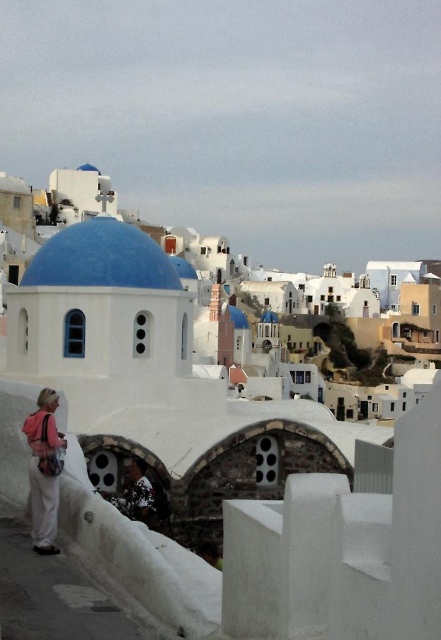
Does blue glossy dome at center have a greater width compared to camouflage shirt at center?

Indeed, blue glossy dome at center has a greater width compared to camouflage shirt at center.

Is blue glossy dome at center closer to the viewer compared to camouflage shirt at center?

No, blue glossy dome at center is further to the viewer.

Image resolution: width=441 pixels, height=640 pixels. What do you see at coordinates (100, 259) in the screenshot?
I see `blue glossy dome at center` at bounding box center [100, 259].

Identify the location of blue glossy dome at center. The width and height of the screenshot is (441, 640). 100,259.

Can you confirm if blue glossy dome at center is positioned below pink fabric at lower left?

No.

Image resolution: width=441 pixels, height=640 pixels. What are the coordinates of `blue glossy dome at center` in the screenshot? It's located at (100, 259).

Which of these two, pink fabric at lower left or camouflage shirt at center, stands shorter?

pink fabric at lower left is shorter.

Can you confirm if pink fabric at lower left is smaller than camouflage shirt at center?

Correct, pink fabric at lower left occupies less space than camouflage shirt at center.

Does point (40, 552) come in front of point (139, 477)?

That is True.

Find the location of `pink fabric at lower left`. pink fabric at lower left is located at coordinates (44, 470).